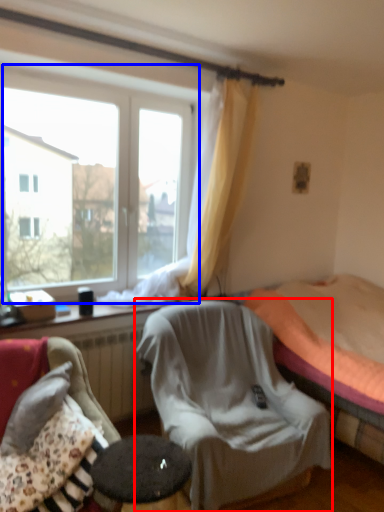
Question: Among these objects, which one is nearest to the camera, chair (highlighted by a red box) or window (highlighted by a blue box)?

Choices:
 (A) chair
 (B) window

Answer: (A)